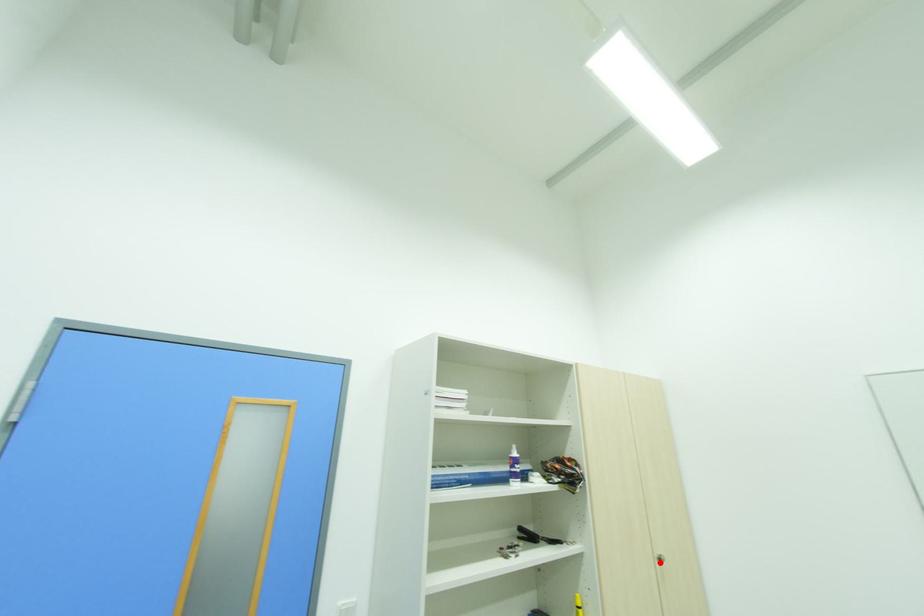
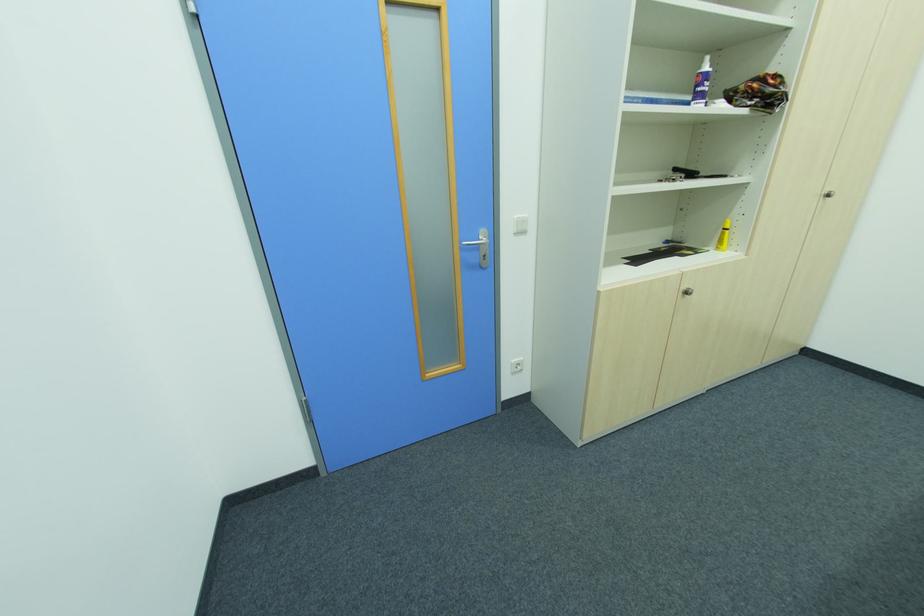
In the second image, find the point that corresponds to the highlighted location in the first image.

(822, 198)